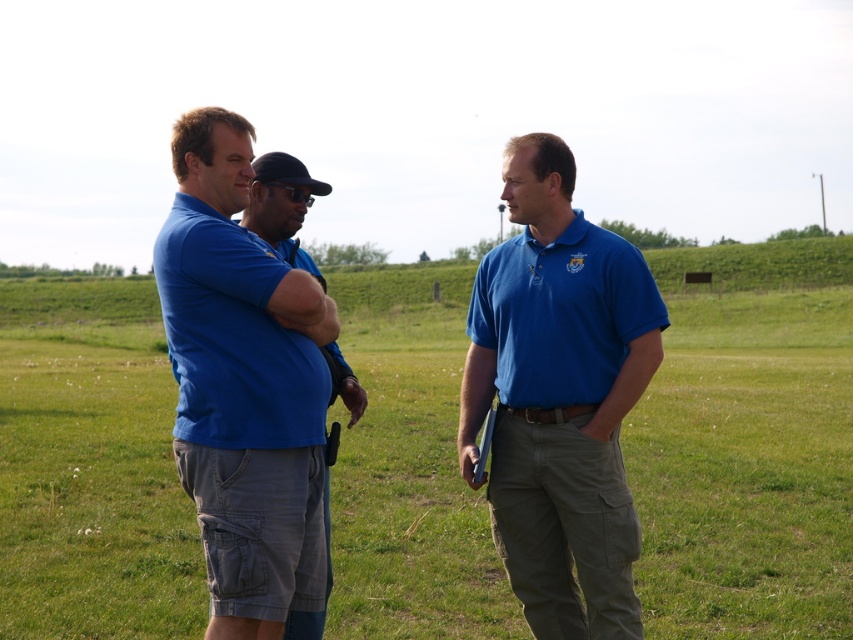
You are a photographer positioned at the origin of the coordinate system. You see a point at coordinates point (233, 337). What object is located at that point?

The point (233, 337) corresponds to the matte blue polo shirt at left.

You are trying to identify the two men wearing the same type of shirt based on their clothing size. Which of the two men, the matte blue polo shirt at left or the matte blue polo shirt at center, is wearing a larger size?

The matte blue polo shirt at left is larger in size than the matte blue polo shirt at center.

You are a photographer trying to capture a group photo of the three men in the grassy field. You notice two men wearing blue shirts at the center of the image. The first is wearing a matte blue shirt at center, and the second is wearing a matte blue polo shirt at center. To ensure both are in frame, should you adjust your camera to focus more to the left or the right side of the current view?

The matte blue shirt at center is to the left of the matte blue polo shirt at center, so you should adjust your camera to focus more to the left side to include both in the frame.